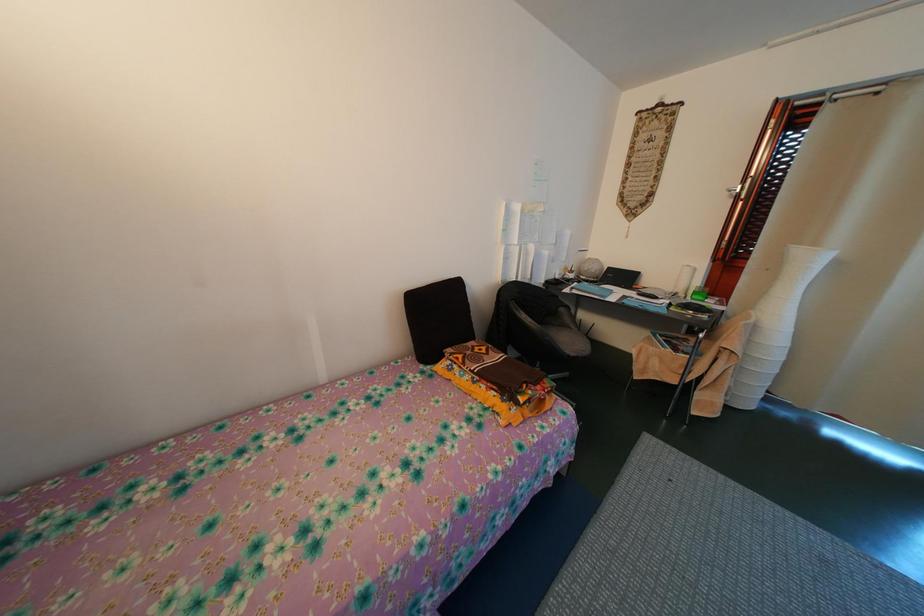
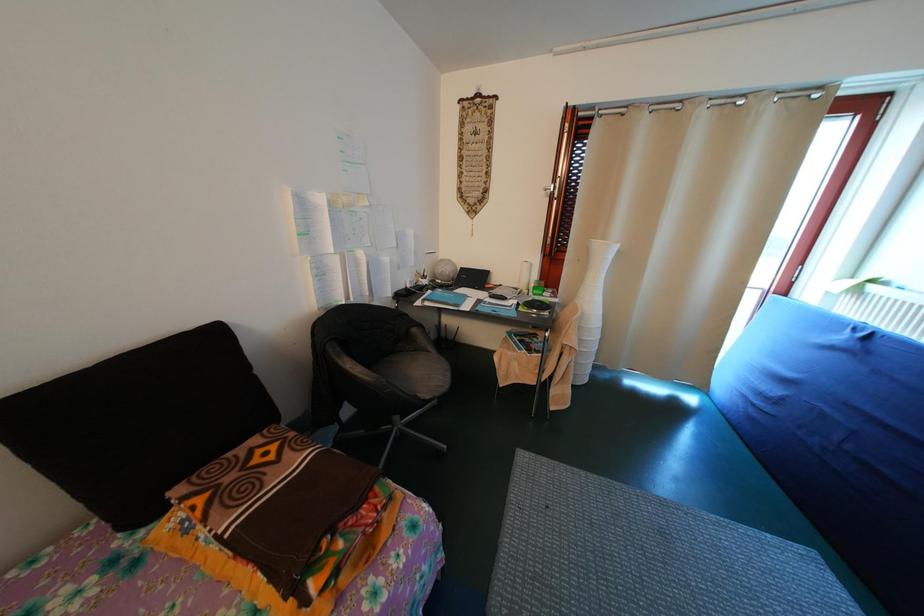
What movement of the cameraman would produce the second image?

The cameraman walked toward right, forward.